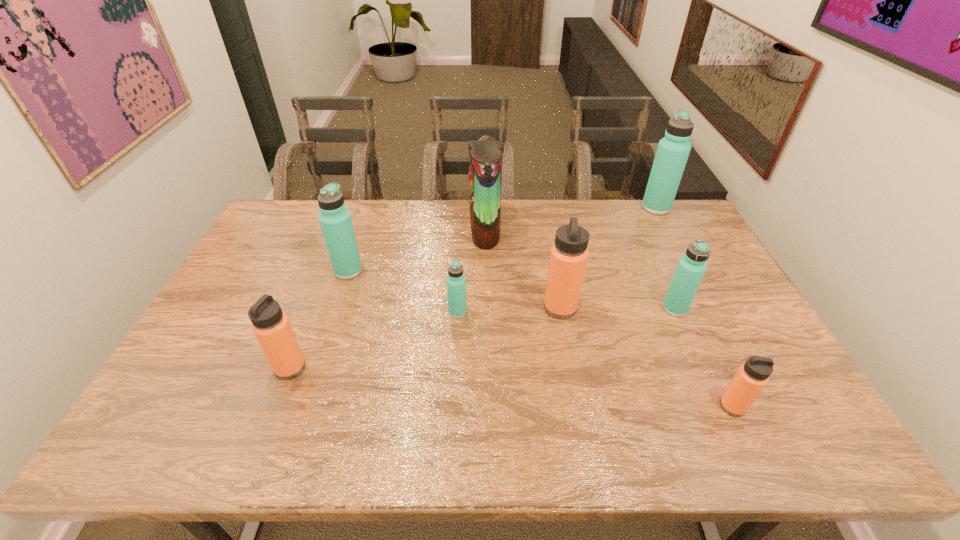
Where is `the smallest aqua thermos bottle`? This screenshot has width=960, height=540. the smallest aqua thermos bottle is located at coordinates (456, 281).

Identify the location of the fifth thermos bottle from right to left. (456, 281).

At what (x,y) coordinates should I click in order to perform the action: click on the nearest orange thermos bottle. Please return your answer as a coordinate pair (x, y). Image resolution: width=960 pixels, height=540 pixels. Looking at the image, I should click on (752, 376).

The height and width of the screenshot is (540, 960). Identify the location of the nearest object. (752, 376).

You are a GUI agent. You are given a task and a screenshot of the screen. Output one action in this format:
    pyautogui.click(x=<x>, y=<y>)
    Task: Click on the free space located on the left of the biggest aqua thermos bottle
    The image size is (960, 540).
    Given the screenshot: What is the action you would take?
    pyautogui.click(x=611, y=207)

Locate an element on the screen. The width and height of the screenshot is (960, 540). free space located 0.200m at the face of the parrot is located at coordinates (413, 230).

Where is `free region located 0.140m at the face of the parrot`? free region located 0.140m at the face of the parrot is located at coordinates (430, 230).

Where is `vacant area situated 0.270m at the face of the parrot`? The image size is (960, 540). vacant area situated 0.270m at the face of the parrot is located at coordinates (394, 230).

Identify the location of vacant position located 0.120m on the left of the second biggest aqua thermos bottle. This screenshot has height=540, width=960. tap(297, 271).

Locate an element on the screen. blank space located on the left of the second orange thermos bottle from left to right is located at coordinates (516, 308).